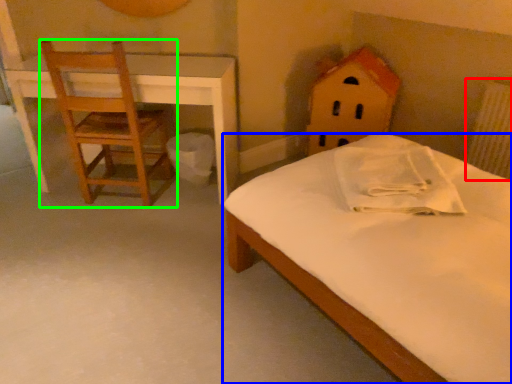
Question: Which object is positioned farthest from radiator (highlighted by a red box)? Select from bed (highlighted by a blue box) and chair (highlighted by a green box).

Choices:
 (A) bed
 (B) chair

Answer: (B)